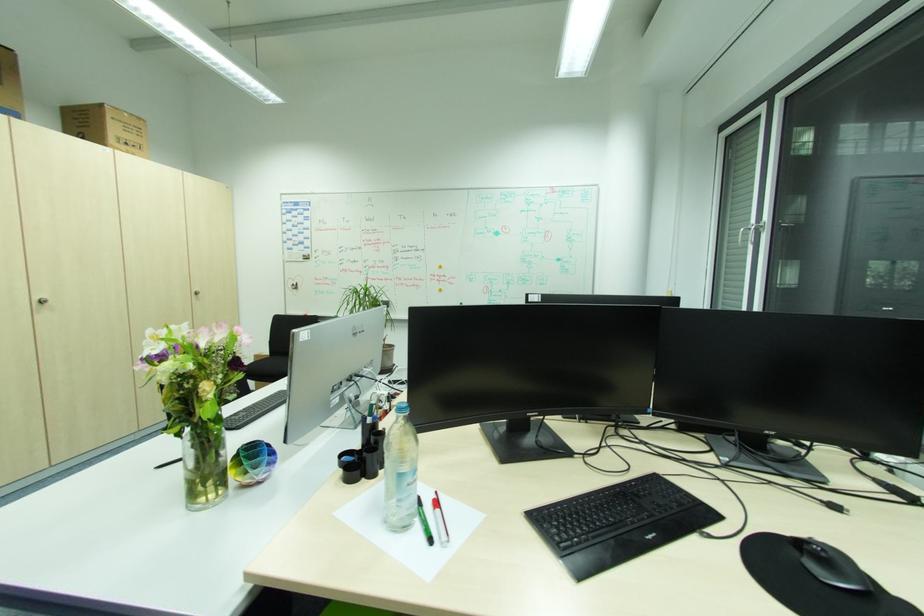
The image size is (924, 616). What do you see at coordinates (269, 368) in the screenshot? I see `the chair sitting surface` at bounding box center [269, 368].